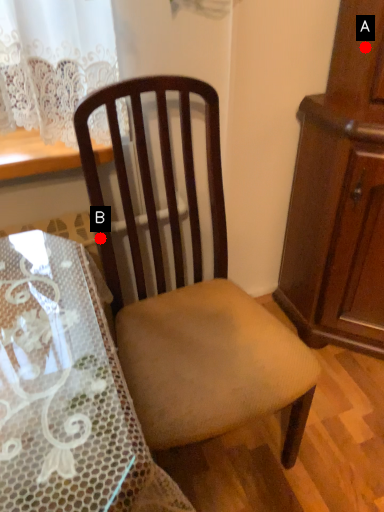
Question: Two points are circled on the image, labeled by A and B beside each circle. Which of the following is the farthest from the observer?

Choices:
 (A) A is further
 (B) B is further

Answer: (A)